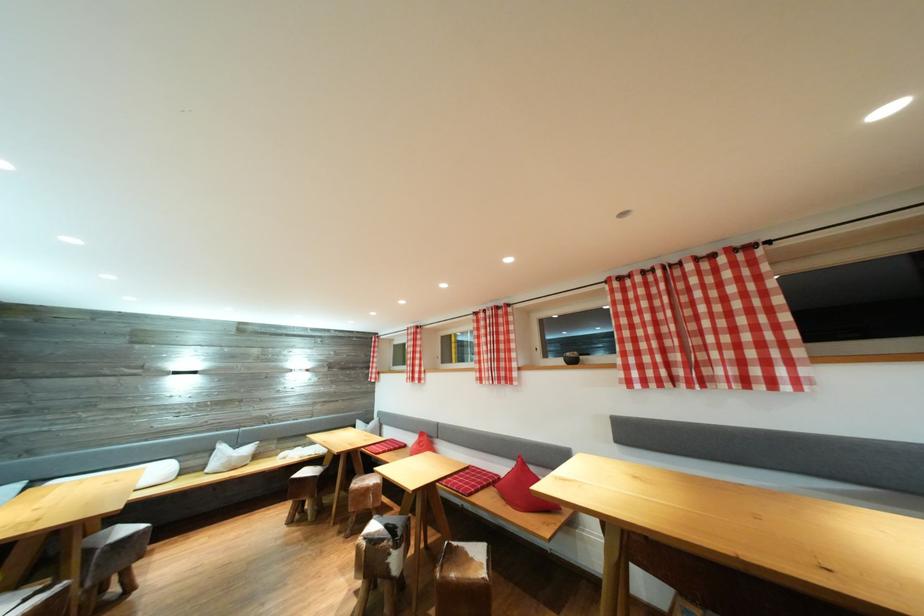
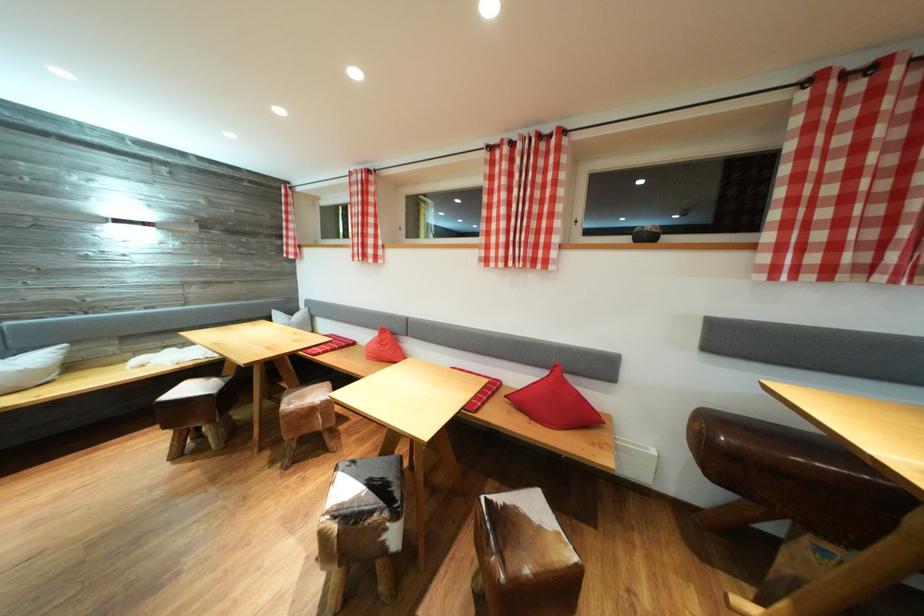
Where in the second image is the point corresponding to pixel 310 508 from the first image?

(203, 434)